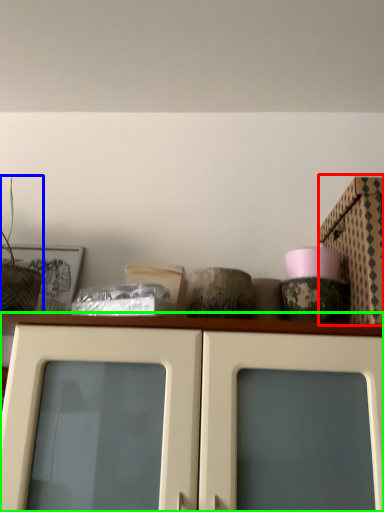
Question: Considering the real-world distances, which object is farthest from cardboard box (highlighted by a red box)? plant (highlighted by a blue box) or cabinetry (highlighted by a green box)?

Choices:
 (A) plant
 (B) cabinetry

Answer: (A)